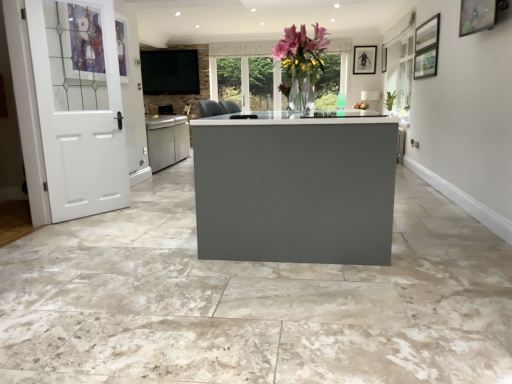
Question: Is matte black tv at upper center wider than white painted wood door at left?

Choices:
 (A) no
 (B) yes

Answer: (B)

Question: Is matte black tv at upper center positioned behind white painted wood door at left?

Choices:
 (A) yes
 (B) no

Answer: (A)

Question: Can you confirm if matte black tv at upper center is bigger than white painted wood door at left?

Choices:
 (A) no
 (B) yes

Answer: (A)

Question: Is matte black tv at upper center taller than white painted wood door at left?

Choices:
 (A) yes
 (B) no

Answer: (B)

Question: Is matte black tv at upper center directly adjacent to white painted wood door at left?

Choices:
 (A) yes
 (B) no

Answer: (B)

Question: From a real-world perspective, is matte black tv at upper center physically above white painted wood door at left?

Choices:
 (A) yes
 (B) no

Answer: (A)

Question: Considering the relative positions of matte black tv at upper center and matte black picture frame at upper right, arranged as the first picture frame when viewed from the top, in the image provided, is matte black tv at upper center behind matte black picture frame at upper right, arranged as the first picture frame when viewed from the top,?

Choices:
 (A) yes
 (B) no

Answer: (A)

Question: Is matte black picture frame at upper right, arranged as the first picture frame when viewed from the top, completely or partially inside matte black tv at upper center?

Choices:
 (A) yes
 (B) no

Answer: (B)

Question: Considering the relative sizes of matte black tv at upper center and matte black picture frame at upper right, the second picture frame in the left-to-right sequence, in the image provided, is matte black tv at upper center taller than matte black picture frame at upper right, the second picture frame in the left-to-right sequence,?

Choices:
 (A) no
 (B) yes

Answer: (B)

Question: Is there a large distance between matte black tv at upper center and matte black picture frame at upper right, arranged as the first picture frame when viewed from the right?

Choices:
 (A) no
 (B) yes

Answer: (B)

Question: Considering the relative positions of matte black tv at upper center and matte black picture frame at upper right, arranged as the first picture frame when viewed from the top, in the image provided, is matte black tv at upper center to the left of matte black picture frame at upper right, arranged as the first picture frame when viewed from the top, from the viewer's perspective?

Choices:
 (A) yes
 (B) no

Answer: (A)

Question: Is matte black tv at upper center touching matte black picture frame at upper right, which is counted as the second picture frame, starting from the front?

Choices:
 (A) yes
 (B) no

Answer: (B)

Question: Is wooden picture frame at upper right, which appears as the first picture frame when viewed from the left, looking in the opposite direction of matte black tv at upper center?

Choices:
 (A) no
 (B) yes

Answer: (A)